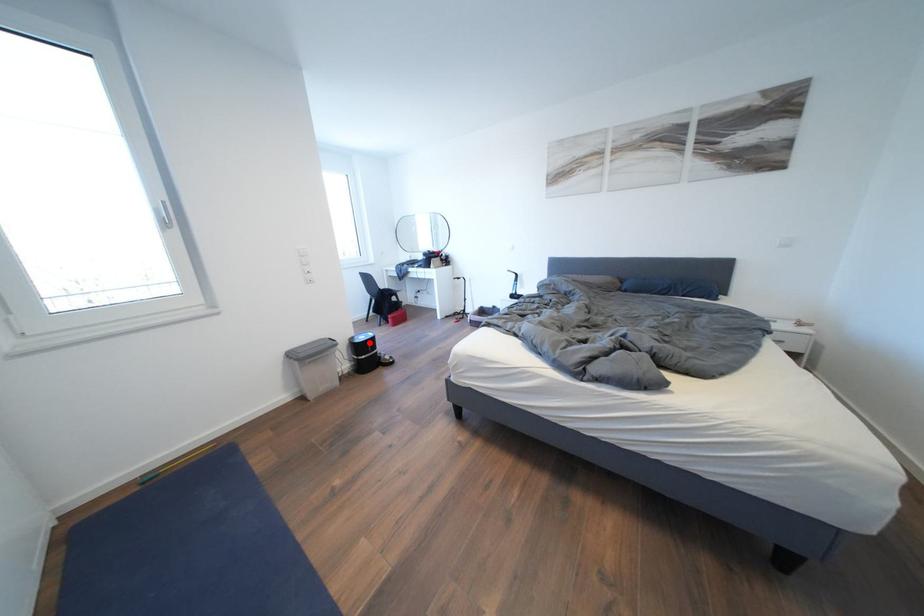
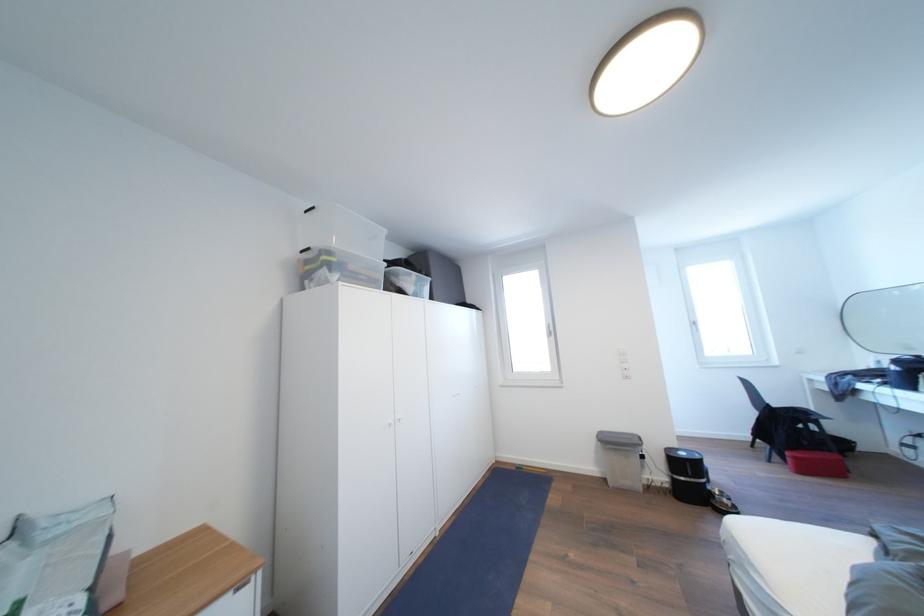
Find the pixel in the second image that matches the highlighted location in the first image.

(689, 459)